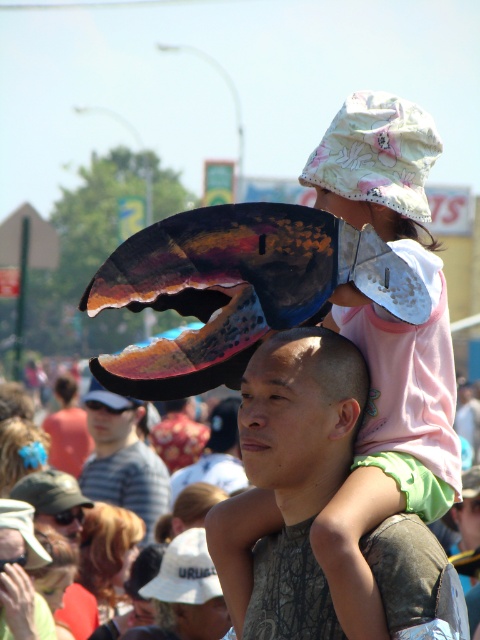
You are a photographer trying to capture a clear shot of the smooth skin head at center. There is a floral cotton bucket hat at upper center in the way. Can you estimate whether the hat will block the head in the photo?

The floral cotton bucket hat at upper center might be wider than smooth skin head at center, so it could potentially block the head in the photo depending on their positions.

Please describe the exact position of the smooth skin head at center in the image using coordinates.

The smooth skin head at center is located at coordinates point (x=301, y=412).